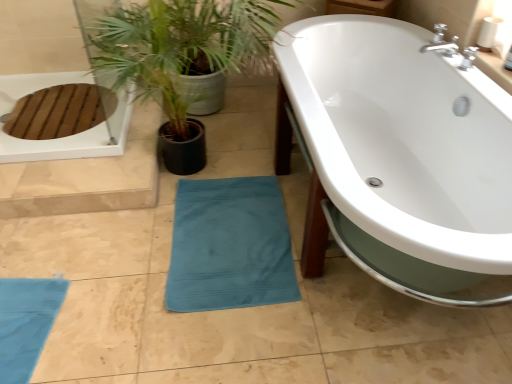
Question: Considering the relative sizes of teal cotton beach towel at lower center and teal fabric plant at lower center in the image provided, is teal cotton beach towel at lower center bigger than teal fabric plant at lower center?

Choices:
 (A) yes
 (B) no

Answer: (B)

Question: Does teal cotton beach towel at lower center have a greater height compared to teal fabric plant at lower center?

Choices:
 (A) yes
 (B) no

Answer: (B)

Question: Considering the relative positions of teal cotton beach towel at lower center and teal fabric plant at lower center in the image provided, is teal cotton beach towel at lower center behind teal fabric plant at lower center?

Choices:
 (A) yes
 (B) no

Answer: (A)

Question: Is teal cotton beach towel at lower center smaller than teal fabric plant at lower center?

Choices:
 (A) no
 (B) yes

Answer: (B)

Question: Is teal cotton beach towel at lower center at the right side of teal fabric plant at lower center?

Choices:
 (A) no
 (B) yes

Answer: (B)

Question: From the image's perspective, is teal cotton beach towel at lower center above or below white glossy bathtub at center?

Choices:
 (A) below
 (B) above

Answer: (A)

Question: Is teal cotton beach towel at lower center inside the boundaries of white glossy bathtub at center, or outside?

Choices:
 (A) outside
 (B) inside

Answer: (A)

Question: Does point pyautogui.click(x=224, y=223) appear closer or farther from the camera than point pyautogui.click(x=414, y=289)?

Choices:
 (A) closer
 (B) farther

Answer: (B)

Question: In the image, is teal cotton beach towel at lower center positioned in front of or behind white glossy bathtub at center?

Choices:
 (A) behind
 (B) front

Answer: (A)

Question: Choose the correct answer: Is white glossy bathtub at center inside teal cotton beach towel at lower center or outside it?

Choices:
 (A) inside
 (B) outside

Answer: (B)

Question: Would you say white glossy bathtub at center is to the left or to the right of teal cotton beach towel at lower center in the picture?

Choices:
 (A) right
 (B) left

Answer: (A)

Question: From the image's perspective, is white glossy bathtub at center positioned above or below teal cotton beach towel at lower center?

Choices:
 (A) below
 (B) above

Answer: (B)

Question: Is point (287, 77) closer or farther from the camera than point (229, 288)?

Choices:
 (A) closer
 (B) farther

Answer: (B)

Question: Is teal fabric plant at lower center situated inside teal cotton beach towel at lower center or outside?

Choices:
 (A) outside
 (B) inside

Answer: (A)

Question: Is point (230, 13) closer or farther from the camera than point (270, 198)?

Choices:
 (A) closer
 (B) farther

Answer: (A)